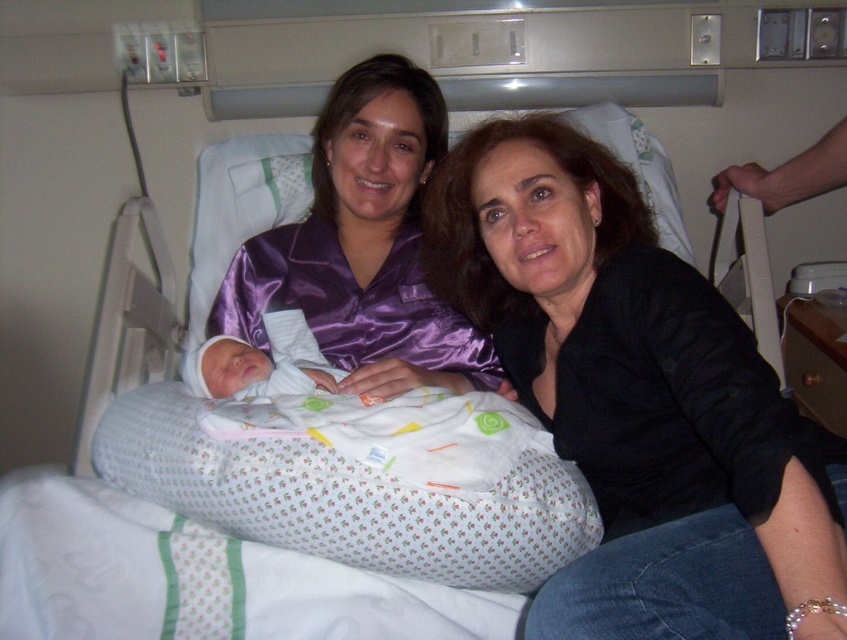
You are a photographer setting up for a family photo in this hospital room. You need to position a small stool between the black satin shirt at center and the soft white swaddled newborn at center. The stool is 15 cm tall. Will the stool fit vertically between them?

The black satin shirt at center is taller than the soft white swaddled newborn at center, so the 15 cm tall stool may not fit vertically between them since the height difference between the two objects is not specified. Please measure the vertical space between them first.

You are a photographer standing in front of the hospital bed. You want to take a closeup photo of the black satin shirt at center without moving any objects. Can you get the shirt in focus while also keeping the baby in the background visible? Explain your reasoning.

The black satin shirt at center is 26.24 inches from the viewer. Since the shirt is relatively close to the camera and the baby is further away, adjusting the camera focus to the shirt would keep it sharp while the baby might appear slightly out of focus. To include both clearly, a wider depth of field or moving closer might be needed.